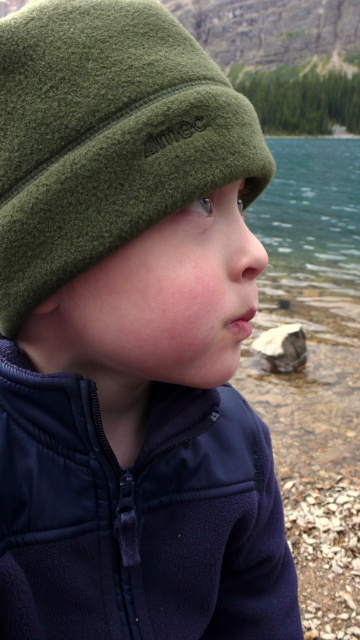
Question: Is the position of olive green fleece beanie at upper left less distant than that of gray rough stone at lower center?

Choices:
 (A) yes
 (B) no

Answer: (A)

Question: Considering the real-world distances, which object is closest to the olive green fleece beanie at upper left?

Choices:
 (A) gray rough stone at lower center
 (B) navy fleece jacket at lower right
 (C) greenish-blue water at center

Answer: (B)

Question: Which of the following is the farthest from the observer?

Choices:
 (A) gray rough stone at lower center
 (B) navy fleece jacket at lower right

Answer: (A)

Question: Which is farther from the greenish-blue water at center?

Choices:
 (A) gray rough stone at lower center
 (B) navy fleece jacket at lower right
 (C) olive green fleece beanie at upper left

Answer: (A)

Question: Can you confirm if navy fleece jacket at lower right is smaller than greenish-blue water at center?

Choices:
 (A) no
 (B) yes

Answer: (B)

Question: Is greenish-blue water at center above gray rough stone at lower center?

Choices:
 (A) no
 (B) yes

Answer: (B)